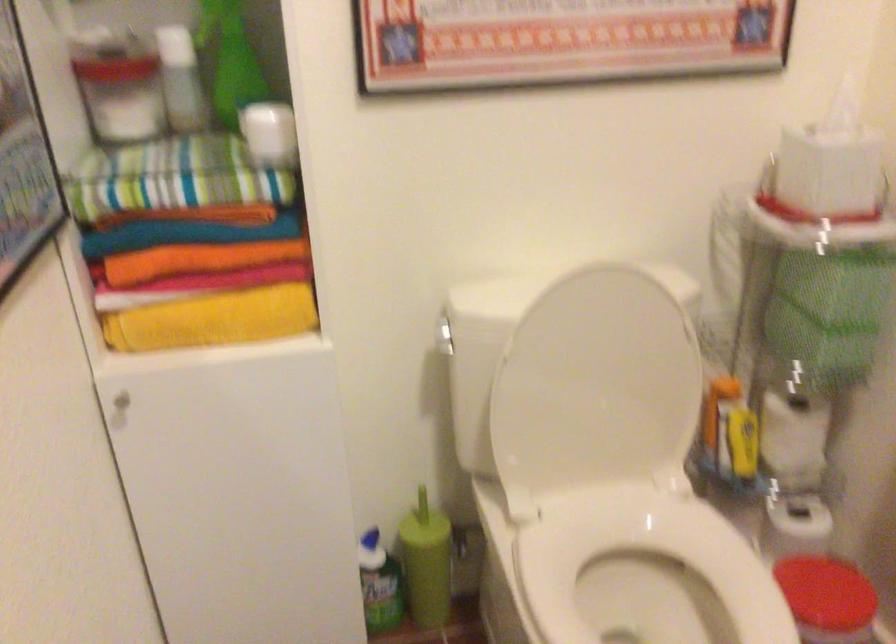
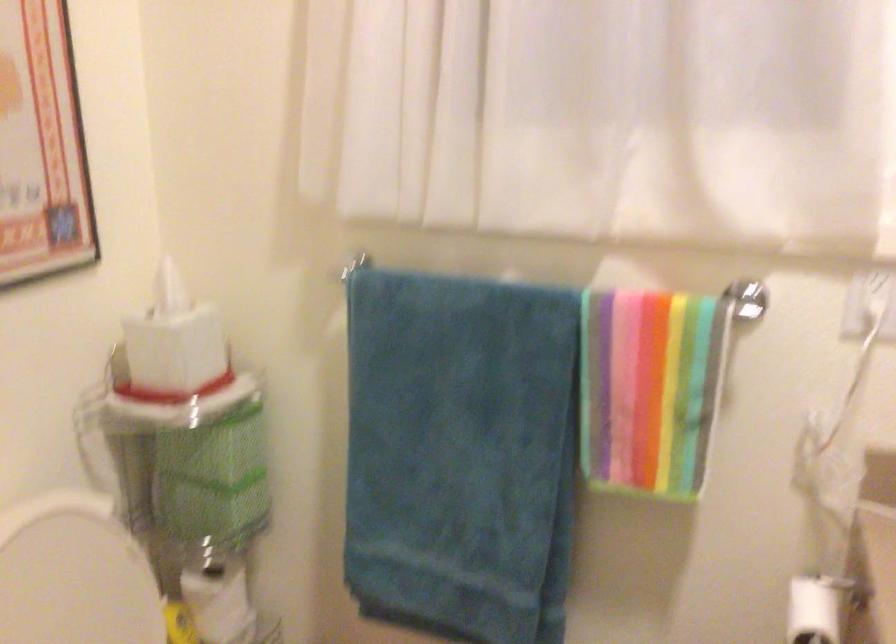
Question: The camera is either moving clockwise (left) or counter-clockwise (right) around the object. The first image is from the beginning of the video and the second image is from the end. Is the camera moving left or right when shooting the video?

Choices:
 (A) Left
 (B) Right

Answer: (A)